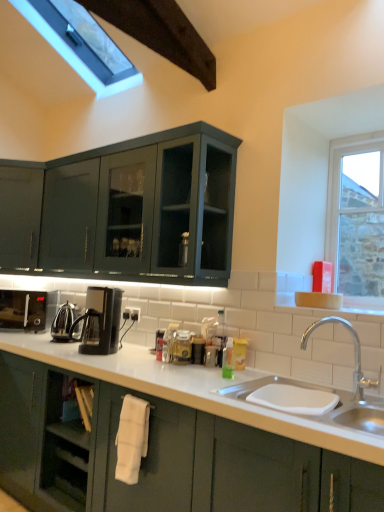
Question: Is clear glass window at upper right taller or shorter than white fabric towel at lower center?

Choices:
 (A) short
 (B) tall

Answer: (B)

Question: From a real-world perspective, is clear glass window at upper right above or below white fabric towel at lower center?

Choices:
 (A) above
 (B) below

Answer: (A)

Question: Estimate the real-world distances between objects in this image. Which object is closer to the white ceramic sink at lower center?

Choices:
 (A) black plastic coffee machine at lower left, which ranks as the 2th coffee machine in front-to-back order
 (B) white glossy sink at lower right
 (C) translucent glass spice jar at center, which is the second appliance from back to front
 (D) white fabric towel at lower center
 (E) polished stainless steel kettle at center-left, marked as the second appliance in a front-to-back arrangement

Answer: (B)

Question: Estimate the real-world distances between objects in this image. Which object is farther from the polished stainless steel kettle at center-left, marked as the 1th appliance in a left-to-right arrangement?

Choices:
 (A) clear glass window at upper right
 (B) white fabric towel at lower center
 (C) white ceramic sink at lower center
 (D) translucent glass spice jar at center, which is the second appliance from back to front
 (E) black plastic coffee machine at center, arranged as the 1th coffee machine when viewed from the right

Answer: (A)